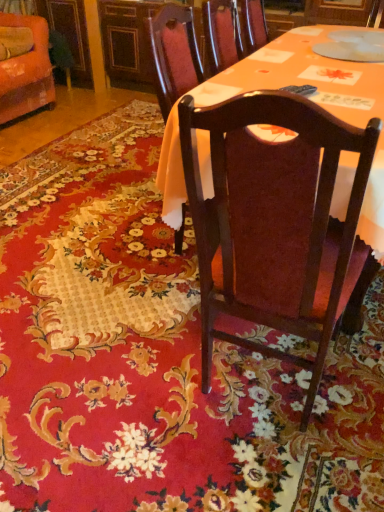
Question: Considering the relative positions of dark wood chair at center, marked as the 1th chair in a right-to-left arrangement, and matte wood table at center in the image provided, is dark wood chair at center, marked as the 1th chair in a right-to-left arrangement, in front of matte wood table at center?

Choices:
 (A) no
 (B) yes

Answer: (B)

Question: Is dark wood chair at center, marked as the 2th chair in a back-to-front arrangement, behind matte wood table at center?

Choices:
 (A) yes
 (B) no

Answer: (B)

Question: Does dark wood chair at center, marked as the 2th chair in a back-to-front arrangement, appear on the left side of matte wood table at center?

Choices:
 (A) yes
 (B) no

Answer: (B)

Question: Can you confirm if dark wood chair at center, the second chair from the top, is smaller than matte wood table at center?

Choices:
 (A) yes
 (B) no

Answer: (B)

Question: Is dark wood chair at center, the 1th chair positioned from the front, taller than matte wood table at center?

Choices:
 (A) no
 (B) yes

Answer: (B)

Question: Based on their sizes in the image, would you say orange fabric chair at upper left, acting as the second chair starting from the bottom, is bigger or smaller than dark wood chair at center, the 1th chair positioned from the front?

Choices:
 (A) big
 (B) small

Answer: (B)

Question: Is orange fabric chair at upper left, which ranks as the 2th chair in front-to-back order, spatially inside dark wood chair at center, marked as the 1th chair in a right-to-left arrangement, or outside of it?

Choices:
 (A) inside
 (B) outside

Answer: (B)

Question: From their relative heights in the image, would you say orange fabric chair at upper left, which appears as the 1th chair when viewed from the top, is taller or shorter than dark wood chair at center, acting as the second chair starting from the left?

Choices:
 (A) short
 (B) tall

Answer: (A)

Question: Is point (6, 120) positioned closer to the camera than point (301, 109)?

Choices:
 (A) closer
 (B) farther

Answer: (B)

Question: Does point (352, 243) appear closer or farther from the camera than point (49, 79)?

Choices:
 (A) farther
 (B) closer

Answer: (B)

Question: From a real-world perspective, is dark wood chair at center, the 1th chair positioned from the front, positioned above or below orange fabric chair at upper left, which ranks as the 2th chair in right-to-left order?

Choices:
 (A) above
 (B) below

Answer: (A)

Question: Visually, is dark wood chair at center, acting as the second chair starting from the left, positioned to the left or to the right of orange fabric chair at upper left, acting as the second chair starting from the bottom?

Choices:
 (A) right
 (B) left

Answer: (A)

Question: In terms of width, does dark wood chair at center, marked as the 1th chair in a right-to-left arrangement, look wider or thinner when compared to orange fabric chair at upper left, which is the 1th chair in left-to-right order?

Choices:
 (A) thin
 (B) wide

Answer: (B)

Question: Based on their positions, is dark wood chair at center, the 1th chair positioned from the front, located to the left or right of matte wood table at center?

Choices:
 (A) right
 (B) left

Answer: (A)

Question: From a real-world perspective, is dark wood chair at center, the 1th chair positioned from the front, above or below matte wood table at center?

Choices:
 (A) above
 (B) below

Answer: (A)